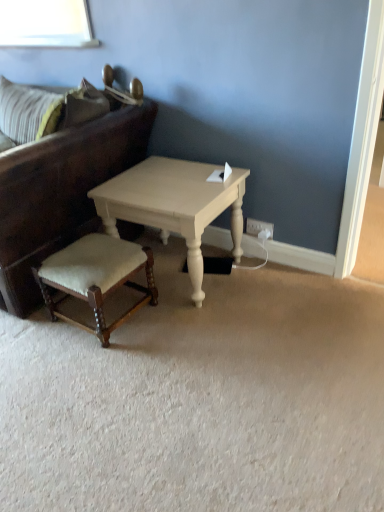
Where is `vacant area that is in front of velvet beige stool at lower left`? The width and height of the screenshot is (384, 512). vacant area that is in front of velvet beige stool at lower left is located at coordinates (89, 366).